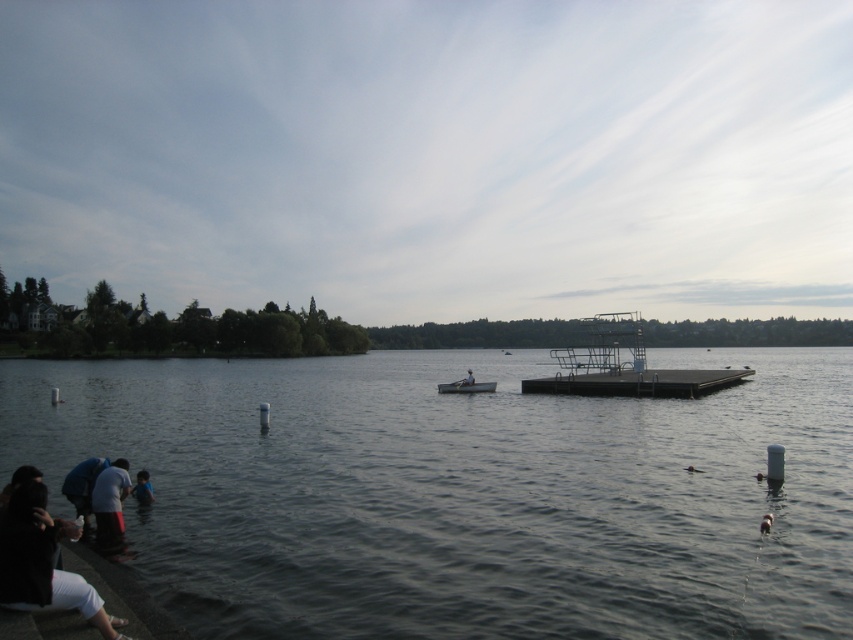
You are standing at the concrete edge where the people are gathered. If you want to reach the black metal dock at center, which direction should you walk towards?

You should walk towards the center of the lake to reach the black metal dock at center.

You are standing at the edge of the lake and see the dark gray water at lower center and the black metal dock at center. Which one is closer to you?

The dark gray water at lower center is closer to you because it is positioned below the black metal dock at center, meaning the dock is elevated above the water.

You are a photographer trying to capture a shot of the black metal dock at center and the blue fabric shirt at lower left. Since you want both subjects to be clearly visible in your photo, which object should you focus on first to ensure proper depth of field?

The black metal dock at center has a greater height compared to the blue fabric shirt at lower left, so you should focus on the black metal dock at center first to ensure both are in focus.